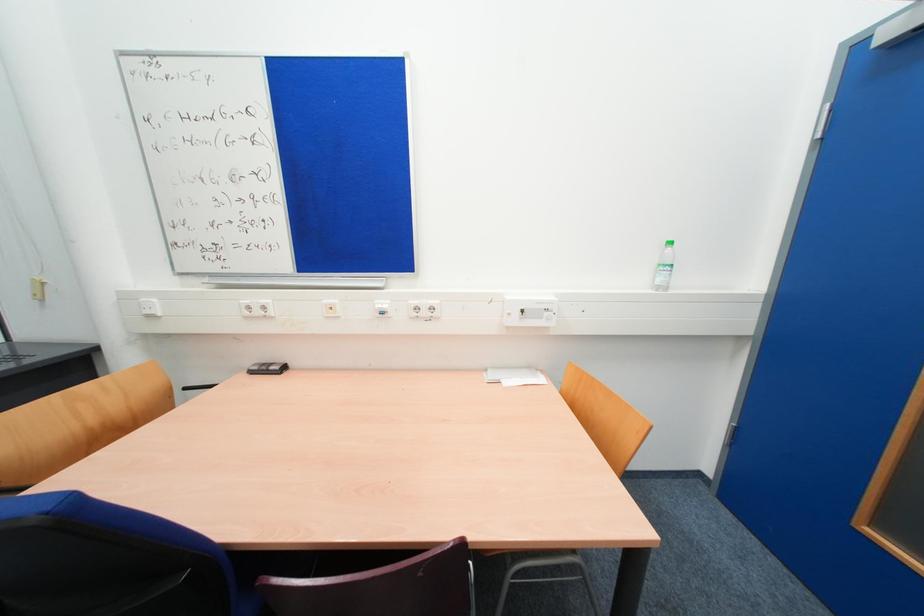
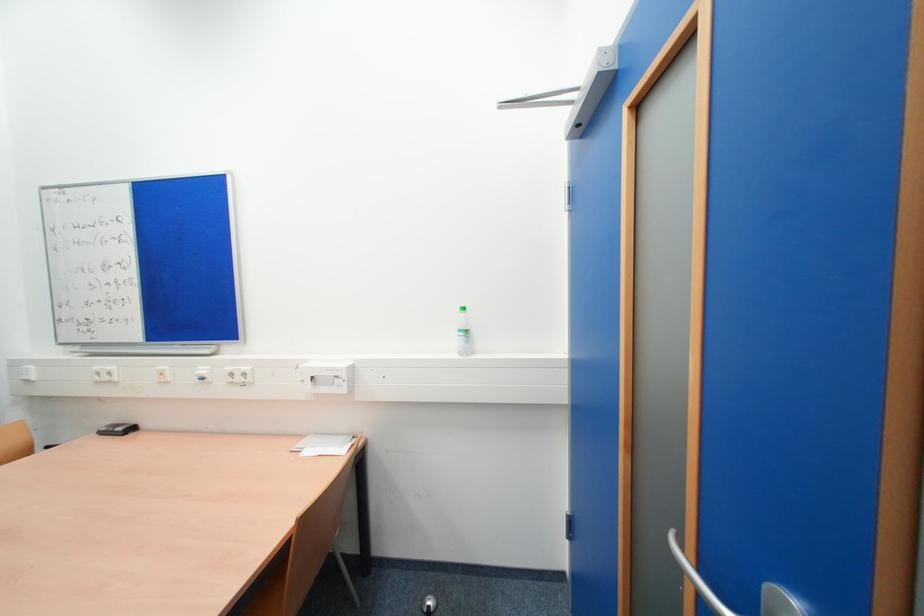
Question: What movement of the cameraman would produce the second image?

Choices:
 (A) Left
 (B) Right
 (C) Forward
 (D) Backward

Answer: (B)